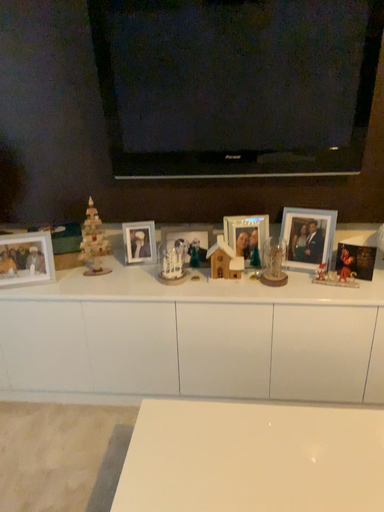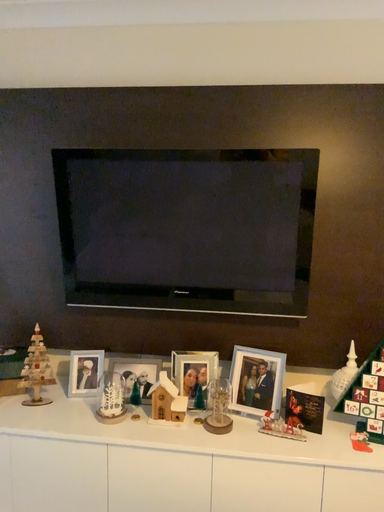
Question: Which way did the camera rotate in the video?

Choices:
 (A) rotated downward
 (B) rotated upward

Answer: (B)